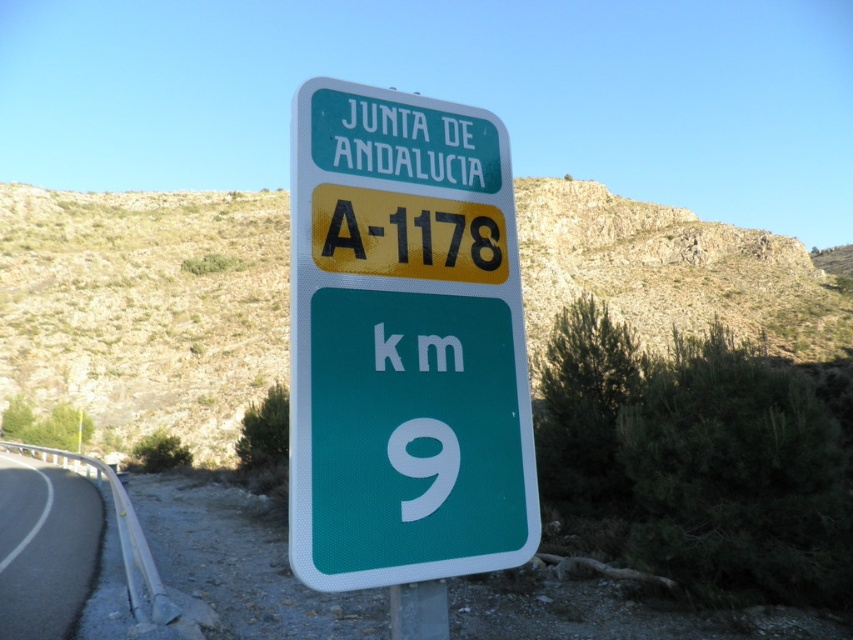
Question: Which of the following is the closest to the observer?

Choices:
 (A) black asphalt road at lower left
 (B) green plastic sign at center

Answer: (B)

Question: Considering the relative positions of green plastic sign at center and black asphalt road at lower left in the image provided, where is green plastic sign at center located with respect to black asphalt road at lower left?

Choices:
 (A) above
 (B) below

Answer: (A)

Question: Which object is closer to the camera taking this photo?

Choices:
 (A) black asphalt road at lower left
 (B) green plastic sign at center

Answer: (B)

Question: Is green plastic sign at center in front of black asphalt road at lower left?

Choices:
 (A) yes
 (B) no

Answer: (A)

Question: Does green plastic sign at center have a smaller size compared to black asphalt road at lower left?

Choices:
 (A) yes
 (B) no

Answer: (A)